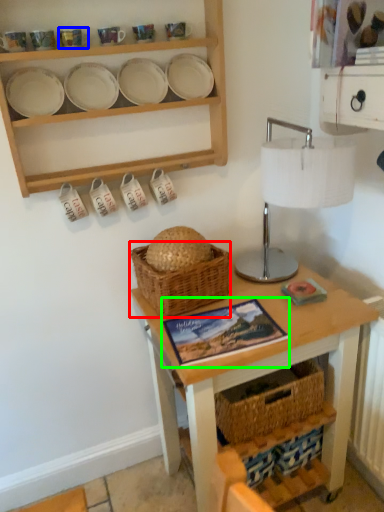
Question: Based on their relative distances, which object is farther from basket (highlighted by a red box)? Choose from tableware (highlighted by a blue box) and book (highlighted by a green box).

Choices:
 (A) tableware
 (B) book

Answer: (A)